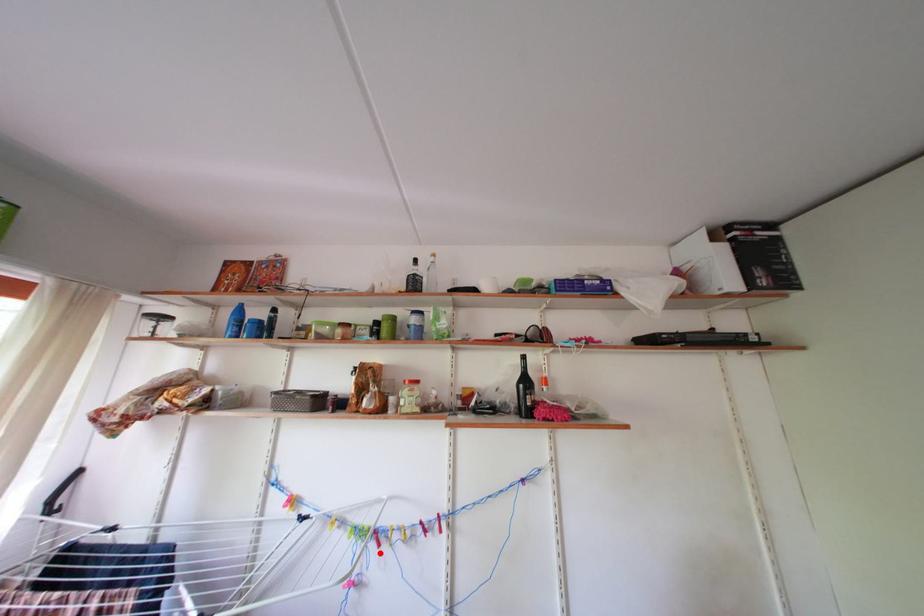
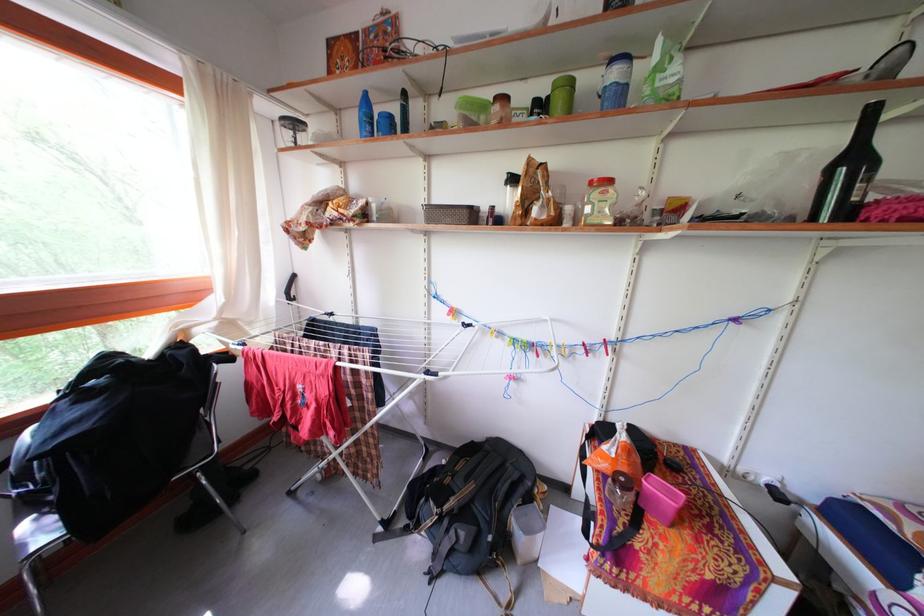
Where in the second image is the point corresponding to the highlighted location from the first image?

(540, 361)